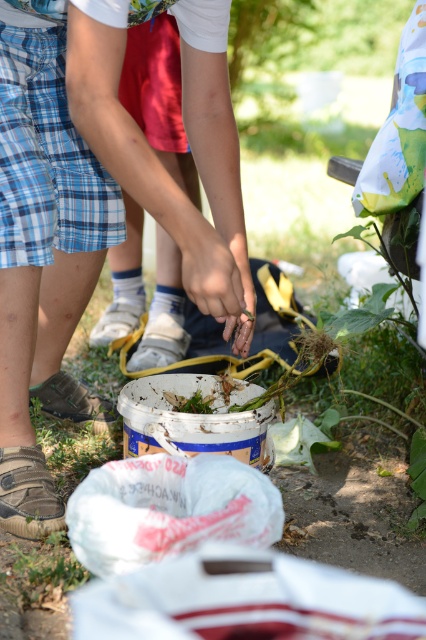
Question: Is blue plaid shorts at lower left below blue plaid shorts at center?

Choices:
 (A) no
 (B) yes

Answer: (B)

Question: Which point appears closest to the camera in this image?

Choices:
 (A) (23, 570)
 (B) (92, 38)

Answer: (B)

Question: Estimate the real-world distances between objects in this image. Which object is closer to the blue plaid shorts at center?

Choices:
 (A) blue plaid shorts at lower left
 (B) green leafy plant at lower left

Answer: (A)

Question: Is blue plaid shorts at center below green leafy plant at lower left?

Choices:
 (A) yes
 (B) no

Answer: (B)

Question: Among these points, which one is farthest from the camera?

Choices:
 (A) (23, 605)
 (B) (60, 179)
 (C) (83, 86)

Answer: (B)

Question: Is blue plaid shorts at lower left above blue plaid shorts at center?

Choices:
 (A) yes
 (B) no

Answer: (B)